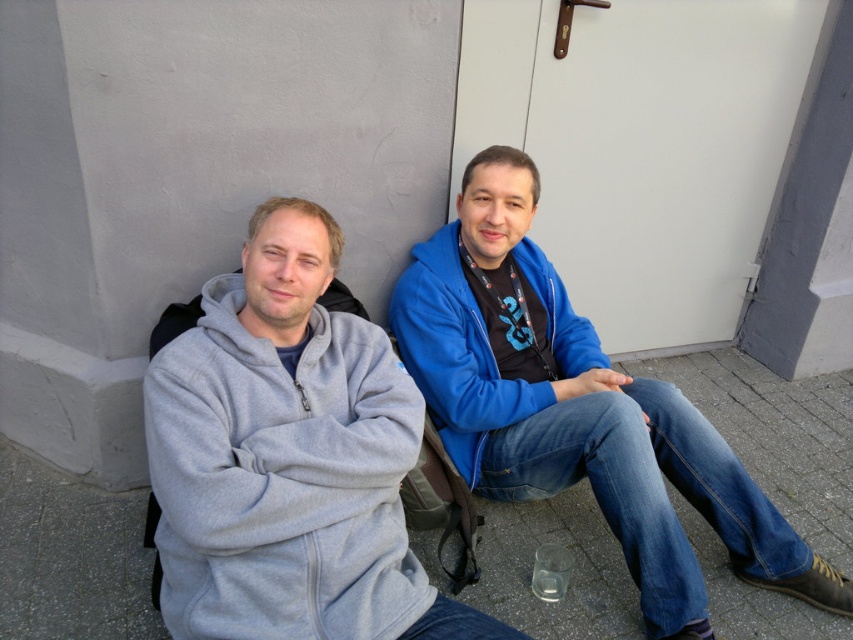
Question: Can you confirm if gray fleece hoodie at left is smaller than blue fleece jacket at center?

Choices:
 (A) yes
 (B) no

Answer: (A)

Question: Can you confirm if gray fleece hoodie at left is thinner than blue fleece jacket at center?

Choices:
 (A) yes
 (B) no

Answer: (A)

Question: Which object is the farthest from the blue fleece jacket at center?

Choices:
 (A) blue fleece sweatshirt at center
 (B) gray fleece hoodie at left

Answer: (B)

Question: Which point appears closest to the camera in this image?

Choices:
 (A) (415, 428)
 (B) (622, 433)

Answer: (A)

Question: Can you confirm if gray fleece hoodie at left is positioned to the left of blue fleece jacket at center?

Choices:
 (A) no
 (B) yes

Answer: (B)

Question: Which point is farther from the camera taking this photo?

Choices:
 (A) (x=556, y=326)
 (B) (x=496, y=422)

Answer: (A)